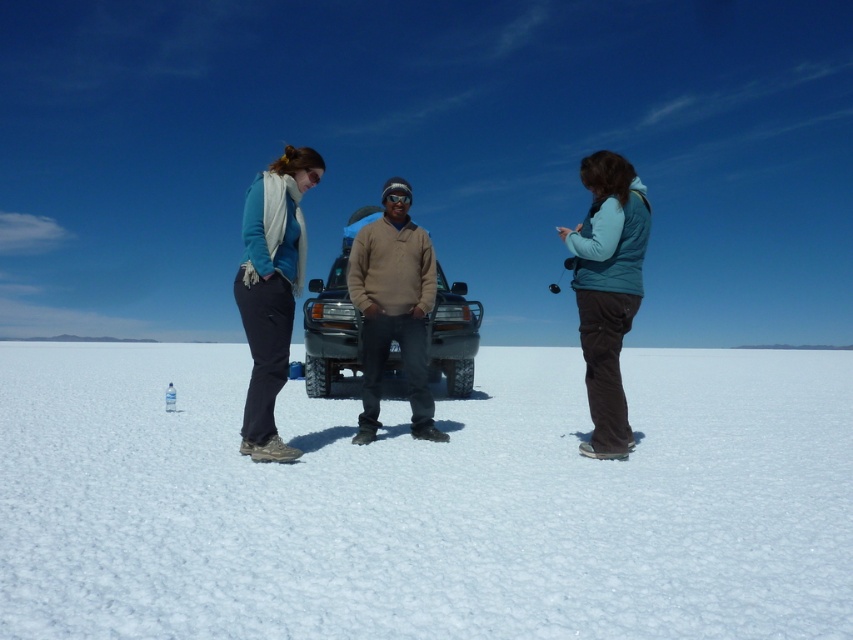
Who is taller, teal fleece vest at center or matte black jeep at center?

Standing taller between the two is matte black jeep at center.

Between teal fleece vest at center and matte black jeep at center, which one is positioned higher?

teal fleece vest at center

Between point (614, 241) and point (303, 324), which one is positioned behind?

The point (303, 324) is more distant.

In order to click on teal fleece vest at center in this screenshot , I will do (607, 291).

Does teal fleece vest at center lie in front of beige sweater at center?

Yes, teal fleece vest at center is in front of beige sweater at center.

Is teal fleece vest at center smaller than beige sweater at center?

Indeed, teal fleece vest at center has a smaller size compared to beige sweater at center.

Does point (627, 164) come farther from viewer compared to point (418, 332)?

No, (627, 164) is closer to viewer.

This screenshot has width=853, height=640. Find the location of `teal fleece vest at center`. teal fleece vest at center is located at coordinates (607, 291).

Can you confirm if white crystalline snow at center is positioned above matte blue sweater at center?

No.

Does white crystalline snow at center lie behind matte blue sweater at center?

That is False.

Identify the location of white crystalline snow at center. The height and width of the screenshot is (640, 853). (425, 500).